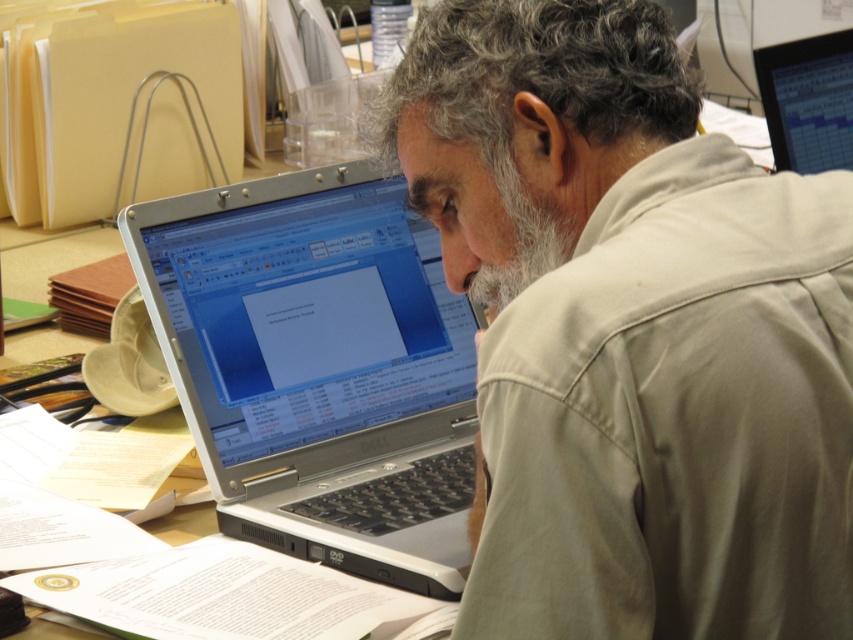
Question: Is beige cotton shirt at center further to camera compared to silver metallic laptop at center?

Choices:
 (A) yes
 (B) no

Answer: (B)

Question: Is silver metallic laptop at center positioned in front of matte black computer screen at upper right?

Choices:
 (A) yes
 (B) no

Answer: (A)

Question: Which point is farther to the camera?

Choices:
 (A) (814, 145)
 (B) (807, 518)
 (C) (230, 195)

Answer: (A)

Question: Which point is farther to the camera?

Choices:
 (A) beige cotton shirt at center
 (B) matte black computer screen at upper right
 (C) silver metallic laptop at center

Answer: (B)

Question: Is silver metallic laptop at center in front of matte black computer screen at upper right?

Choices:
 (A) yes
 (B) no

Answer: (A)

Question: Estimate the real-world distances between objects in this image. Which object is closer to the silver metallic laptop at center?

Choices:
 (A) beige cotton shirt at center
 (B) matte black computer screen at upper right

Answer: (A)